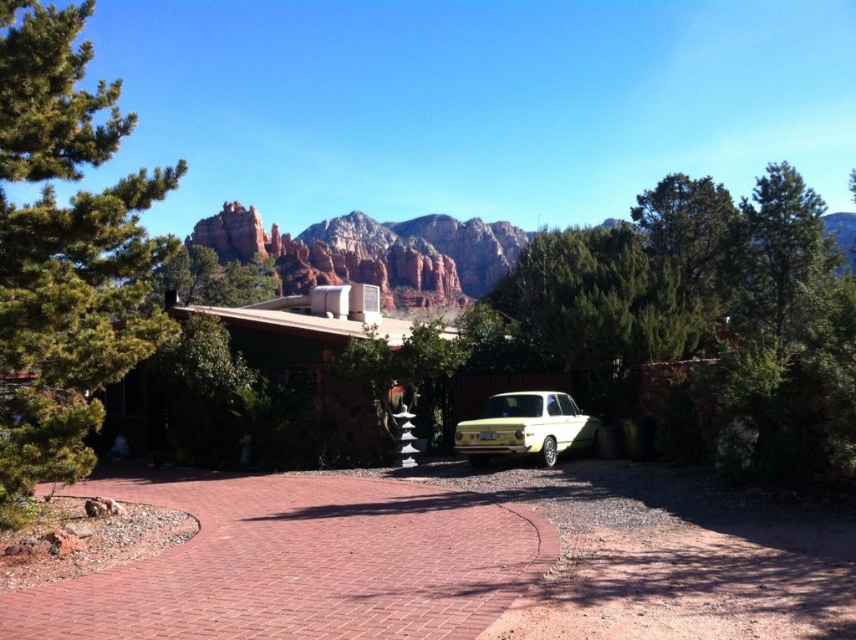
Question: Among these objects, which one is nearest to the camera?

Choices:
 (A) yellow matte car at center
 (B) brick at center
 (C) green textured tree at upper right
 (D) green pine tree at left

Answer: (B)

Question: Considering the real-world distances, which object is farthest from the yellow matte car at center?

Choices:
 (A) green pine tree at left
 (B) brick at center

Answer: (A)

Question: Which point appears closest to the camera in this image?

Choices:
 (A) (40, 60)
 (B) (229, 588)
 (C) (795, 179)
 (D) (580, 442)

Answer: (B)

Question: Is green pine tree at left wider than green textured tree at upper right?

Choices:
 (A) yes
 (B) no

Answer: (A)

Question: Can you confirm if green textured tree at upper right is wider than yellow matte car at center?

Choices:
 (A) yes
 (B) no

Answer: (B)

Question: Does brick at center appear under yellow matte car at center?

Choices:
 (A) no
 (B) yes

Answer: (B)